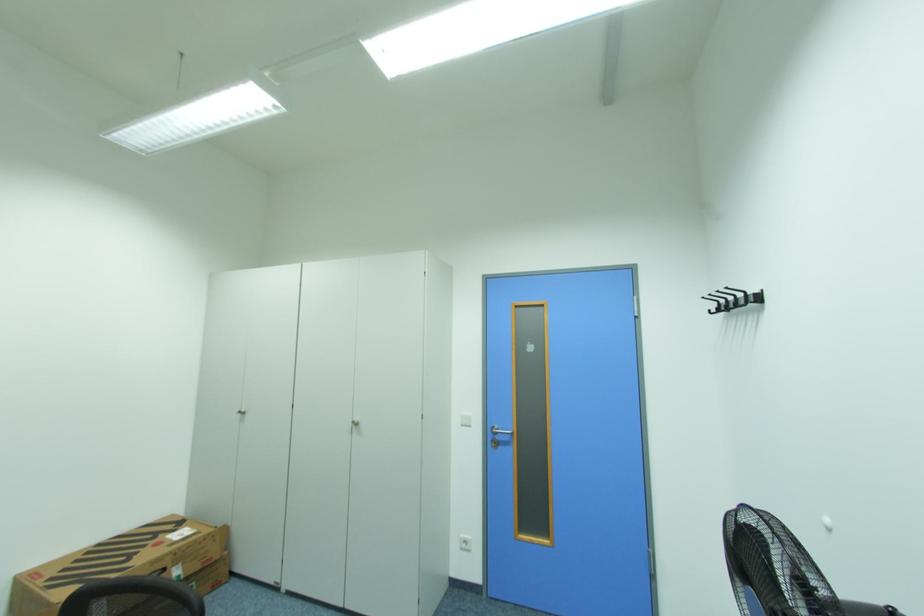
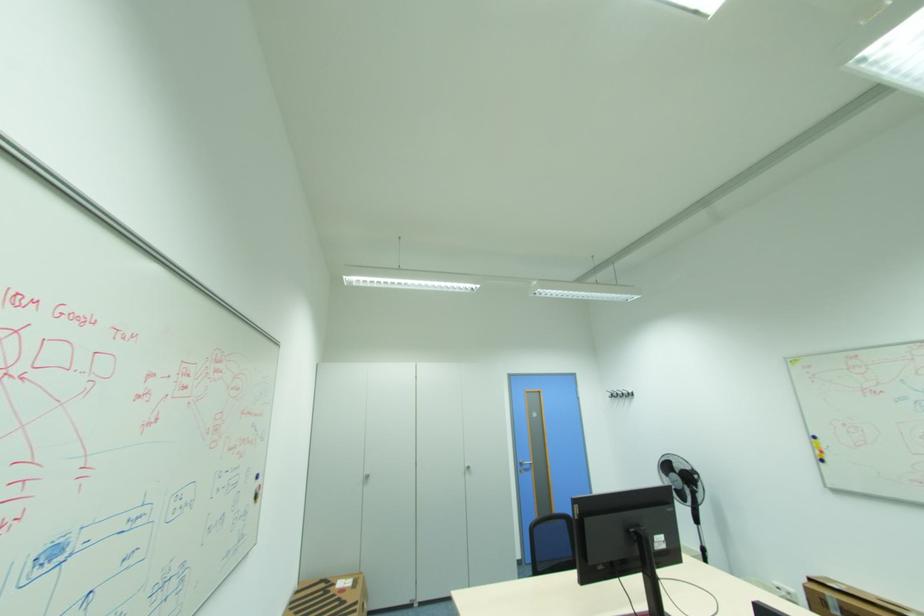
The point at (248, 413) is marked in the first image. Where is the corresponding point in the second image?

(372, 477)